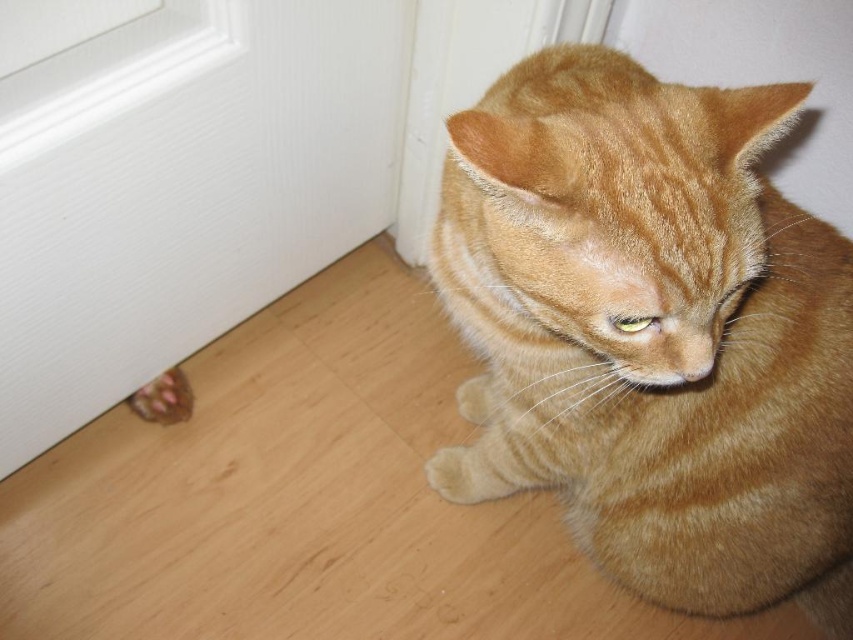
Question: Can you confirm if orange tabby cat at lower right is thinner than brown textured paw at lower left?

Choices:
 (A) yes
 (B) no

Answer: (B)

Question: Which object appears farthest from the camera in this image?

Choices:
 (A) white textured door at lower left
 (B) brown textured paw at lower left
 (C) orange tabby cat at lower right

Answer: (B)

Question: Does orange tabby cat at lower right appear under white textured door at lower left?

Choices:
 (A) yes
 (B) no

Answer: (A)

Question: Which point appears farthest from the camera in this image?

Choices:
 (A) (41, 243)
 (B) (184, 404)
 (C) (834, 408)

Answer: (B)

Question: Among these objects, which one is farthest from the camera?

Choices:
 (A) brown textured paw at lower left
 (B) orange tabby cat at lower right

Answer: (A)

Question: Does orange tabby cat at lower right have a smaller size compared to brown textured paw at lower left?

Choices:
 (A) no
 (B) yes

Answer: (A)